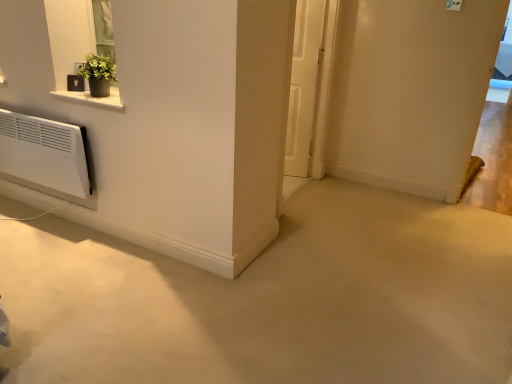
Where is `unoccupied region to the right of white matte door at center`? The image size is (512, 384). unoccupied region to the right of white matte door at center is located at coordinates (316, 185).